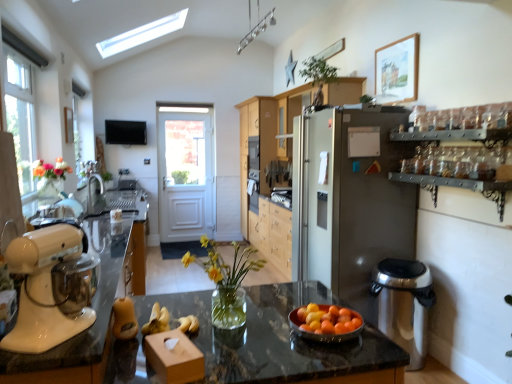
Question: Should I look upward or downward to see black granite countertop at center, positioned as the first countertop in right-to-left order?

Choices:
 (A) down
 (B) up

Answer: (A)

Question: Does orange matte bowl at center come in front of light wood cabinetry at center, which is the second cabinetry from front to back?

Choices:
 (A) yes
 (B) no

Answer: (A)

Question: Is orange matte bowl at center further to the viewer compared to light wood cabinetry at center, acting as the first cabinetry starting from the back?

Choices:
 (A) no
 (B) yes

Answer: (A)

Question: Could you tell me if orange matte bowl at center is facing light wood cabinetry at center, which is the second cabinetry from front to back?

Choices:
 (A) yes
 (B) no

Answer: (A)

Question: Does orange matte bowl at center have a larger size compared to light wood cabinetry at center, acting as the first cabinetry starting from the back?

Choices:
 (A) no
 (B) yes

Answer: (A)

Question: Is orange matte bowl at center not close to light wood cabinetry at center, which is the second cabinetry from front to back?

Choices:
 (A) yes
 (B) no

Answer: (A)

Question: From the image's perspective, is orange matte bowl at center under light wood cabinetry at center, which is the second cabinetry from front to back?

Choices:
 (A) no
 (B) yes

Answer: (B)

Question: Is orange matte bowl at center outside of white glossy stand mixer at left?

Choices:
 (A) no
 (B) yes

Answer: (B)

Question: Considering the relative positions of orange matte bowl at center and white glossy stand mixer at left in the image provided, is orange matte bowl at center to the left of white glossy stand mixer at left from the viewer's perspective?

Choices:
 (A) yes
 (B) no

Answer: (B)

Question: From the image's perspective, does orange matte bowl at center appear lower than white glossy stand mixer at left?

Choices:
 (A) no
 (B) yes

Answer: (B)

Question: Does orange matte bowl at center have a lesser height compared to white glossy stand mixer at left?

Choices:
 (A) no
 (B) yes

Answer: (B)

Question: Is orange matte bowl at center positioned far away from white glossy stand mixer at left?

Choices:
 (A) yes
 (B) no

Answer: (B)

Question: Would you say orange matte bowl at center contains white glossy stand mixer at left?

Choices:
 (A) no
 (B) yes

Answer: (A)

Question: Is orange matte bowl at center inside white glossy stand mixer at left?

Choices:
 (A) yes
 (B) no

Answer: (B)